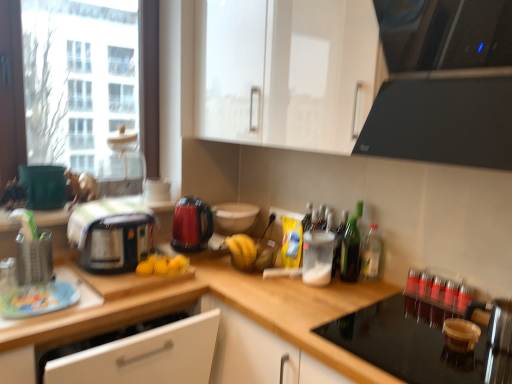
Question: Considering the positions of black glass cooktop at upper right and black glass stovetop at lower right, positioned as the fifth appliance in left-to-right order, in the image, is black glass cooktop at upper right bigger or smaller than black glass stovetop at lower right, positioned as the fifth appliance in left-to-right order,?

Choices:
 (A) small
 (B) big

Answer: (B)

Question: From a real-world perspective, is black glass cooktop at upper right above or below black glass stovetop at lower right, which is the first appliance from right to left?

Choices:
 (A) above
 (B) below

Answer: (A)

Question: Which object is positioned farthest from the black glass cooktop at upper right?

Choices:
 (A) black glass stovetop at lower right, positioned as the fifth appliance in left-to-right order
 (B) green glass bottle at right, which is the 1th bottle in left-to-right order
 (C) white glossy bowl at center, the third appliance from the left
 (D) wooden at center, acting as the first countertop starting from the right
 (E) green matte bucket at left, the 1th appliance viewed from the left

Answer: (E)

Question: Estimate the real-world distances between objects in this image. Which object is farther from the green glass bottle at right, which is the 1th bottle in left-to-right order?

Choices:
 (A) wooden at left, which is the 2th countertop from right to left
 (B) green matte bucket at left, which is counted as the fifth appliance, starting from the right
 (C) glossy plastic kettle at center, marked as the 1th kitchen appliance in a right-to-left arrangement
 (D) black plastic toaster at left, the first kitchen appliance viewed from the left
 (E) black glass cooktop at upper right

Answer: (B)